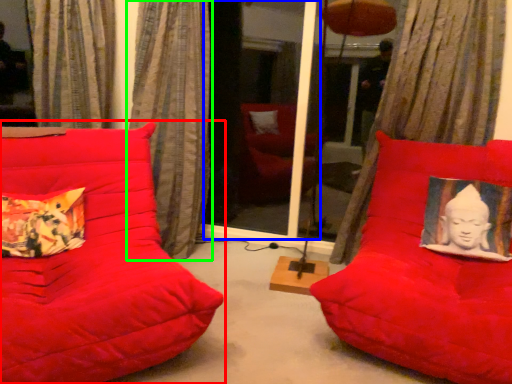
Question: Considering the real-world distances, which object is closest to furniture (highlighted by a red box)? screen door (highlighted by a blue box) or curtain (highlighted by a green box).

Choices:
 (A) screen door
 (B) curtain

Answer: (B)